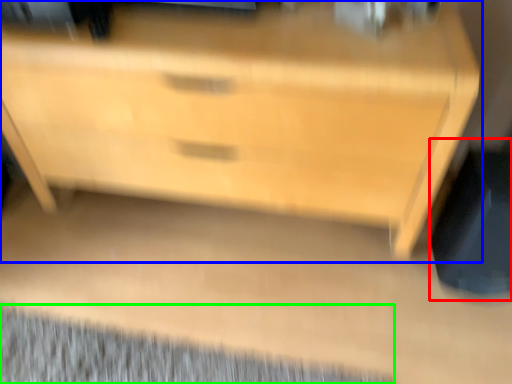
Question: Considering the real-world distances, which object is farthest from swivel chair (highlighted by a red box)? chest of drawers (highlighted by a blue box) or mat (highlighted by a green box)?

Choices:
 (A) chest of drawers
 (B) mat

Answer: (B)